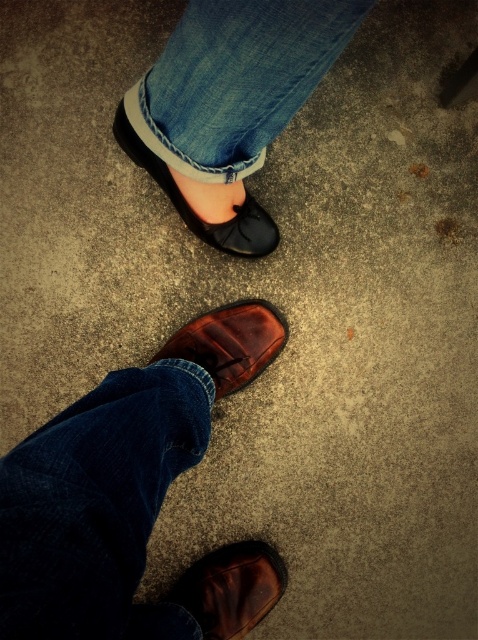
Does point (184, 134) lie in front of point (164, 346)?

Yes, point (184, 134) is in front of point (164, 346).

Does denim at center have a lesser height compared to shiny brown leather shoe at lower center?

Correct, denim at center is not as tall as shiny brown leather shoe at lower center.

Is point (249, 154) less distant than point (252, 376)?

Yes.

Image resolution: width=478 pixels, height=640 pixels. In order to click on denim at center in this screenshot , I will do `click(236, 80)`.

Is dark blue denim jeans at lower left taller than matte black shoe at center?

No, dark blue denim jeans at lower left is not taller than matte black shoe at center.

Image resolution: width=478 pixels, height=640 pixels. I want to click on dark blue denim jeans at lower left, so click(x=97, y=506).

Does dark blue denim jeans at lower left have a larger size compared to brown leather shoe at lower center?

Correct, dark blue denim jeans at lower left is larger in size than brown leather shoe at lower center.

The height and width of the screenshot is (640, 478). Find the location of `dark blue denim jeans at lower left`. dark blue denim jeans at lower left is located at coordinates (97, 506).

In order to click on dark blue denim jeans at lower left in this screenshot , I will do `click(97, 506)`.